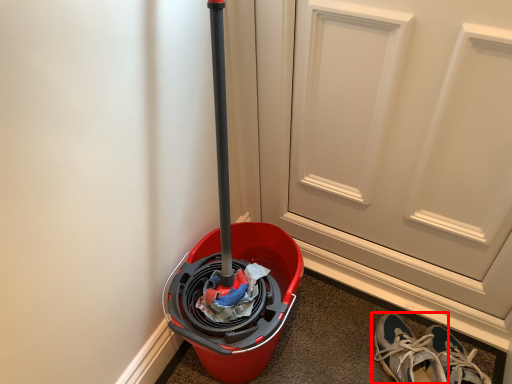
Question: From the image's perspective, what is the correct spatial positioning of footwear (annotated by the red box) in reference to door?

Choices:
 (A) below
 (B) above

Answer: (A)